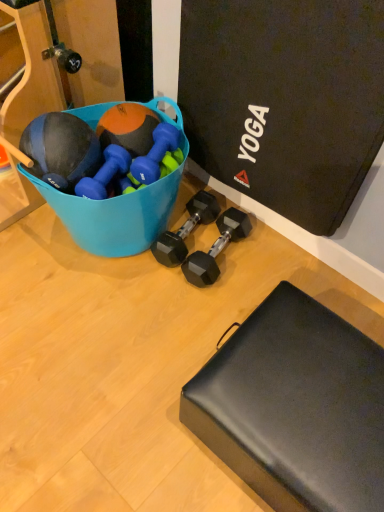
Find the location of a particular element. vacant space in front of black rubber dumbbell at center, which ranks as the third dumbbell in left-to-right order is located at coordinates (182, 295).